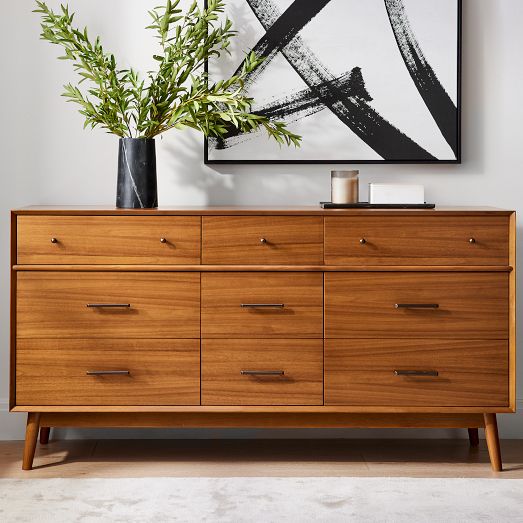
This screenshot has width=523, height=523. What are the coordinates of `wood floor space to left of dresser` in the screenshot? It's located at (13, 453).